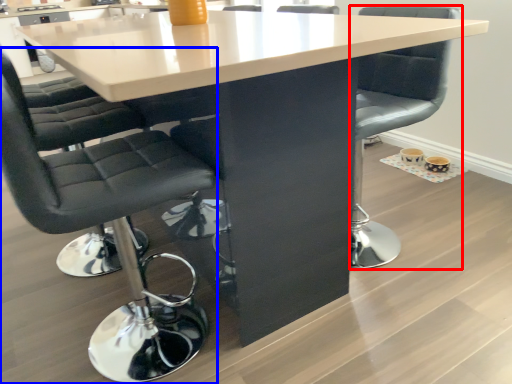
Question: Which object appears farthest to the camera in this image, chair (highlighted by a red box) or chair (highlighted by a blue box)?

Choices:
 (A) chair
 (B) chair

Answer: (A)